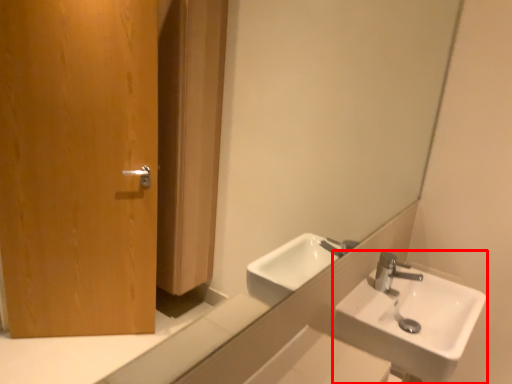
Question: Considering the relative positions of sink (annotated by the red box) and mirror in the image provided, where is sink (annotated by the red box) located with respect to the staircase?

Choices:
 (A) left
 (B) right

Answer: (B)